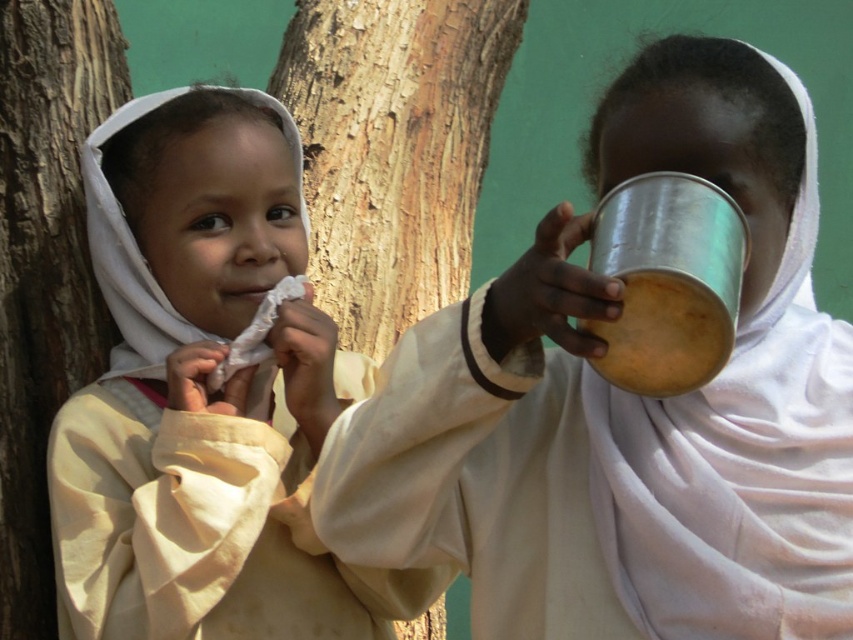
What is the color of the cloth at the coordinates point (x=206, y=406)?

The point (x=206, y=406) is on light beige cloth at left.

You are a botanist examining the tree trunk in the image. Which part of the tree trunk would you expect to be higher up from the ground, the smooth brown bark at left or the rough bark tree at left?

The smooth brown bark at left is located above the rough bark tree at left, so it is higher up from the ground.